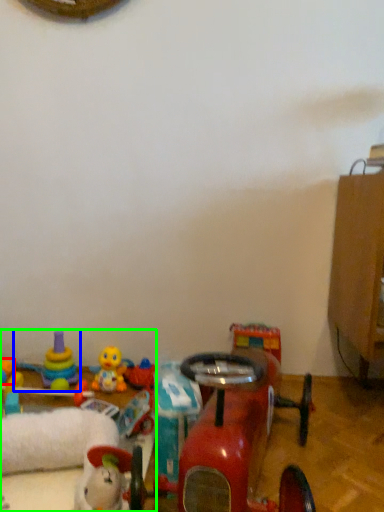
Question: Which is farther away from toy (highlighted by a red box)? toy (highlighted by a blue box) or toy (highlighted by a green box)?

Choices:
 (A) toy
 (B) toy

Answer: (B)